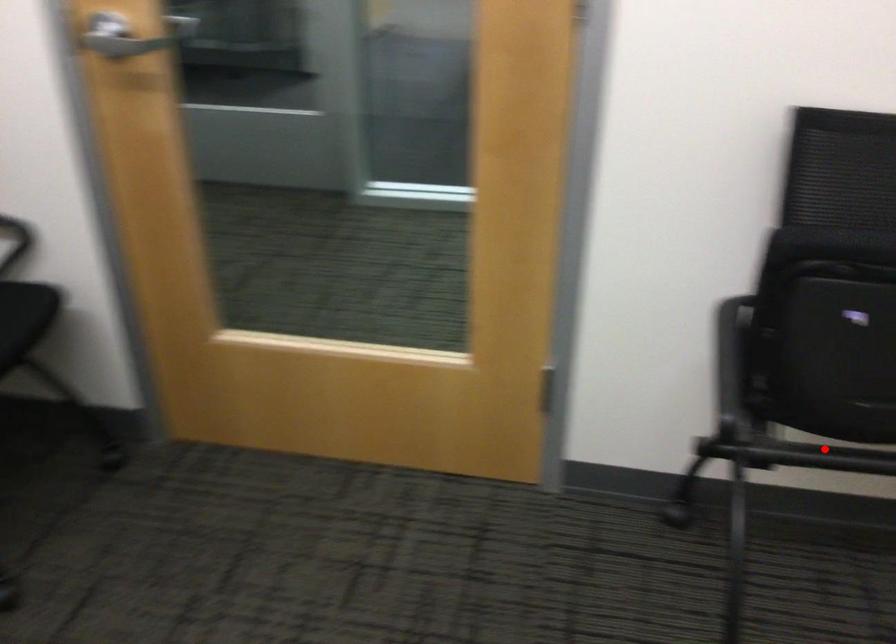
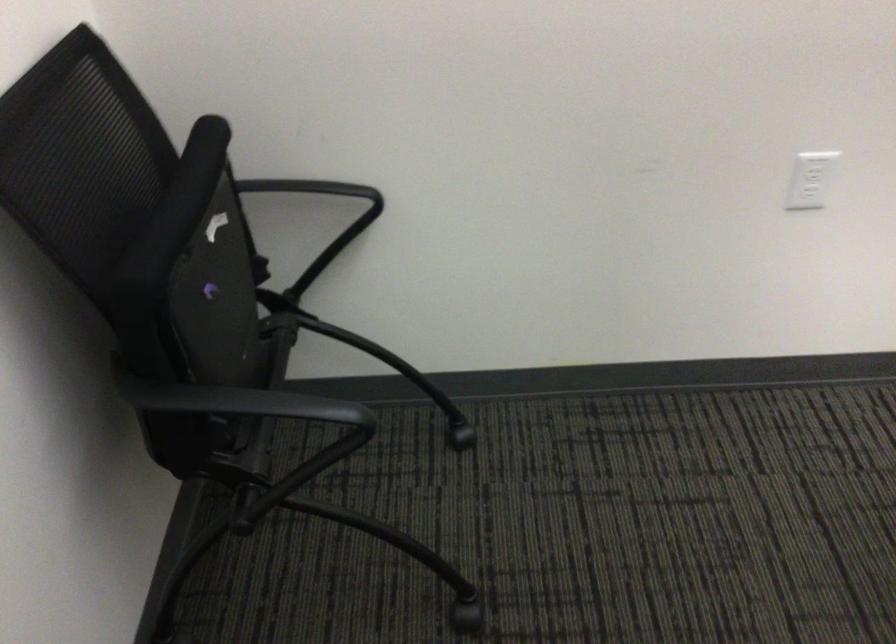
Question: I am providing you with two images of the same scene from different viewpoints. A red point is shown in image1. For the corresponding object point in image2, is it positioned nearer or farther from the camera?

Choices:
 (A) Nearer
 (B) Farther

Answer: (A)